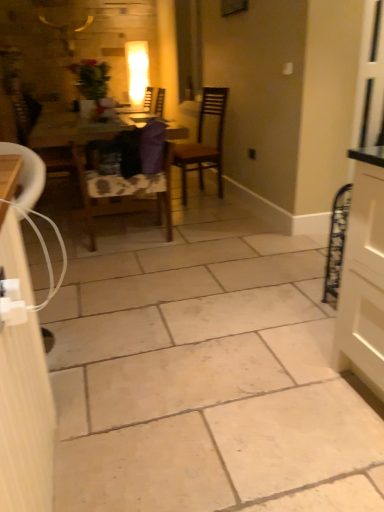
I want to click on free spot to the right of wooden chair at center, which is the 2th chair from left to right, so click(x=196, y=236).